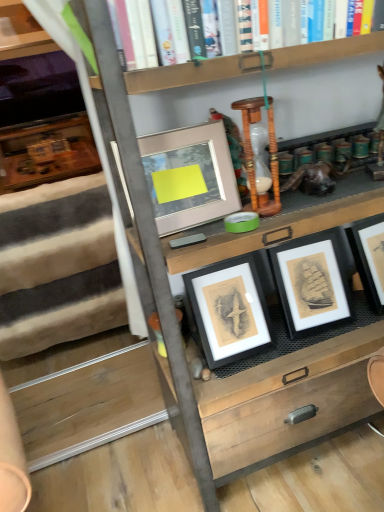
Question: Which direction should I rotate to look at matte black picture frame at center, which is the third picture frame in left-to-right order?

Choices:
 (A) left
 (B) right

Answer: (B)

Question: Are matte gray picture frame at upper center, the first picture frame in the left-to-right sequence, and hardcover book at upper center making contact?

Choices:
 (A) no
 (B) yes

Answer: (A)

Question: Is matte gray picture frame at upper center, which ranks as the third picture frame in right-to-left order, bigger than hardcover book at upper center?

Choices:
 (A) yes
 (B) no

Answer: (B)

Question: Is hardcover book at upper center completely or partially inside matte gray picture frame at upper center, which ranks as the third picture frame in right-to-left order?

Choices:
 (A) no
 (B) yes

Answer: (A)

Question: Does matte gray picture frame at upper center, the first picture frame in the left-to-right sequence, have a smaller size compared to hardcover book at upper center?

Choices:
 (A) yes
 (B) no

Answer: (A)

Question: Is matte gray picture frame at upper center, which ranks as the third picture frame in right-to-left order, at the left side of hardcover book at upper center?

Choices:
 (A) yes
 (B) no

Answer: (B)

Question: From the image's perspective, is matte gray picture frame at upper center, which ranks as the third picture frame in right-to-left order, above hardcover book at upper center?

Choices:
 (A) no
 (B) yes

Answer: (A)

Question: Considering the relative positions of soft woolen rug at left and matte wood shelf at upper left in the image provided, is soft woolen rug at left to the right of matte wood shelf at upper left from the viewer's perspective?

Choices:
 (A) yes
 (B) no

Answer: (A)

Question: Is soft woolen rug at left not within matte wood shelf at upper left?

Choices:
 (A) yes
 (B) no

Answer: (A)

Question: Does soft woolen rug at left have a larger size compared to matte wood shelf at upper left?

Choices:
 (A) no
 (B) yes

Answer: (B)

Question: From a real-world perspective, is soft woolen rug at left on matte wood shelf at upper left?

Choices:
 (A) yes
 (B) no

Answer: (B)

Question: Does soft woolen rug at left have a lesser height compared to matte wood shelf at upper left?

Choices:
 (A) no
 (B) yes

Answer: (A)

Question: Is the depth of soft woolen rug at left less than that of matte wood shelf at upper left?

Choices:
 (A) yes
 (B) no

Answer: (A)

Question: From the image's perspective, is matte gray picture frame at upper center, the first picture frame in the left-to-right sequence, on soft woolen rug at left?

Choices:
 (A) no
 (B) yes

Answer: (B)